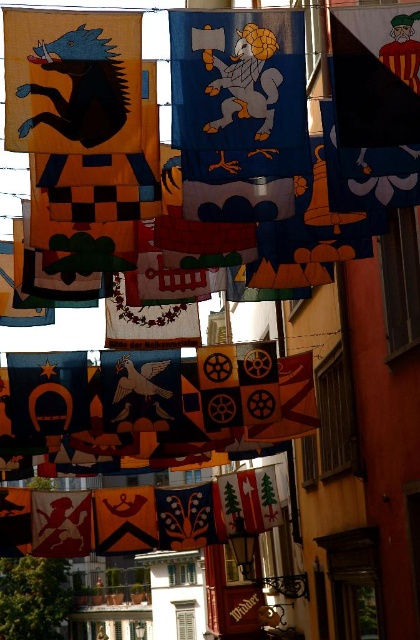
Consider the image. Is orange felt shield at center smaller than silky red cloth at lower left?

Correct, orange felt shield at center occupies less space than silky red cloth at lower left.

Is orange felt shield at center thinner than silky red cloth at lower left?

Incorrect, orange felt shield at center's width is not less than silky red cloth at lower left's.

Between point (123, 538) and point (88, 493), which one is positioned behind?

The point (88, 493) is behind.

Where is `orange felt shield at center`? This screenshot has width=420, height=640. orange felt shield at center is located at coordinates (125, 518).

Is orange felt shield at center below silky orange flag at lower left?

Incorrect, orange felt shield at center is not positioned below silky orange flag at lower left.

From the picture: Does orange felt shield at center have a lesser height compared to silky orange flag at lower left?

Correct, orange felt shield at center is not as tall as silky orange flag at lower left.

Which is in front, point (110, 499) or point (28, 548)?

Point (110, 499) is more forward.

This screenshot has height=640, width=420. In order to click on orange felt shield at center in this screenshot , I will do `click(125, 518)`.

Does blue matte horseshoe at center have a lesser height compared to silky blue fabric at center?

No, blue matte horseshoe at center is not shorter than silky blue fabric at center.

In order to click on blue matte horseshoe at center in this screenshot , I will do `click(47, 392)`.